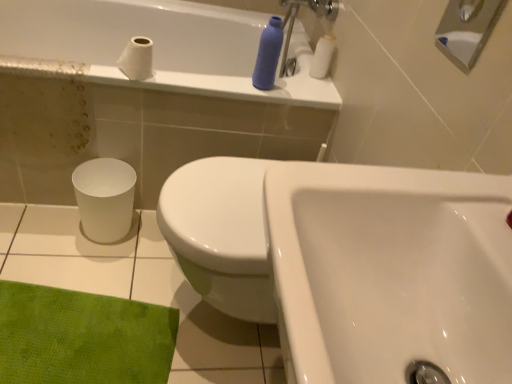
The image size is (512, 384). I want to click on free space in front of white matte toilet paper at upper right, which ranks as the 2th toilet paper in left-to-right order, so click(x=311, y=90).